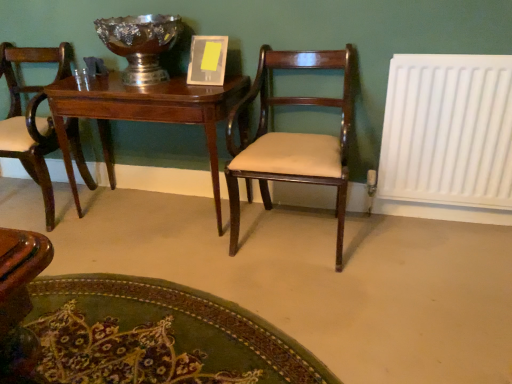
Where is `free location in front of mahogany wood chair at center, acting as the first chair starting from the right`? free location in front of mahogany wood chair at center, acting as the first chair starting from the right is located at coordinates (320, 284).